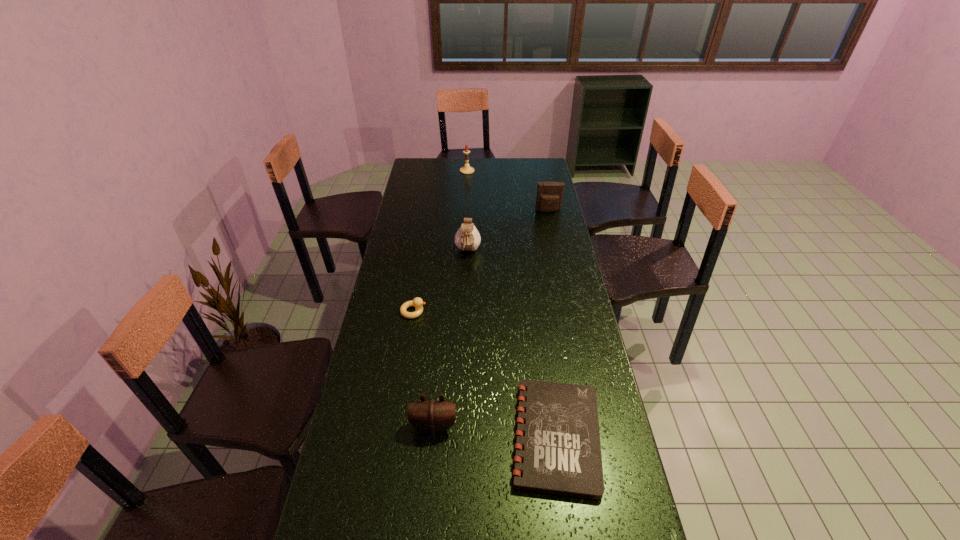
What are the coordinates of `free region located with an open flap on the rightmost pouch` in the screenshot? It's located at (554, 238).

Identify the location of vacant space situated 0.390m on the front-facing side of the fourth nearest object. The image size is (960, 540). (465, 331).

Identify the location of vacant area situated with the flap open on the nearest pouch. The width and height of the screenshot is (960, 540). (430, 469).

The width and height of the screenshot is (960, 540). What are the coordinates of `free space located 0.300m at the beak of the duckling` in the screenshot? It's located at (509, 312).

The image size is (960, 540). In order to click on free space located 0.080m on the back of the notebook in this screenshot , I will do `click(546, 364)`.

Find the location of `object that is at the far edge`. object that is at the far edge is located at coordinates (466, 169).

Identify the location of object at the left edge. (417, 302).

Where is `pouch that is at the right edge`? This screenshot has width=960, height=540. pouch that is at the right edge is located at coordinates (549, 197).

In order to click on notebook that is positioned at the right edge in this screenshot , I will do `click(562, 455)`.

The image size is (960, 540). In order to click on vacant space at the far edge of the desktop in this screenshot , I will do `click(497, 160)`.